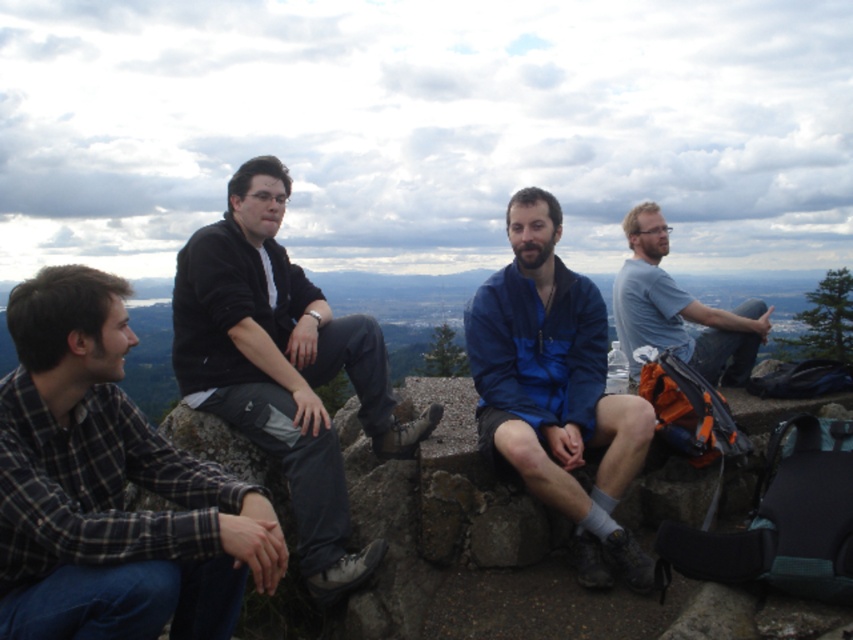
Question: Which of the following is the farthest from the observer?

Choices:
 (A) flannel shirt at left
 (B) blue fabric jacket at center
 (C) dark gray fabric pants at center
 (D) gray cotton t-shirt at upper right

Answer: (D)

Question: Estimate the real-world distances between objects in this image. Which object is farther from the gray cotton t-shirt at upper right?

Choices:
 (A) flannel shirt at left
 (B) blue fabric jacket at center

Answer: (A)

Question: Can you confirm if dark gray fabric pants at center is positioned above gray cotton t-shirt at upper right?

Choices:
 (A) yes
 (B) no

Answer: (B)

Question: Does dark gray fabric pants at center have a smaller size compared to gray cotton t-shirt at upper right?

Choices:
 (A) no
 (B) yes

Answer: (B)

Question: Can you confirm if dark gray fabric pants at center is positioned to the right of gray cotton t-shirt at upper right?

Choices:
 (A) yes
 (B) no

Answer: (B)

Question: Which of the following is the closest to the observer?

Choices:
 (A) click(x=155, y=440)
 (B) click(x=584, y=548)
 (C) click(x=721, y=337)

Answer: (A)